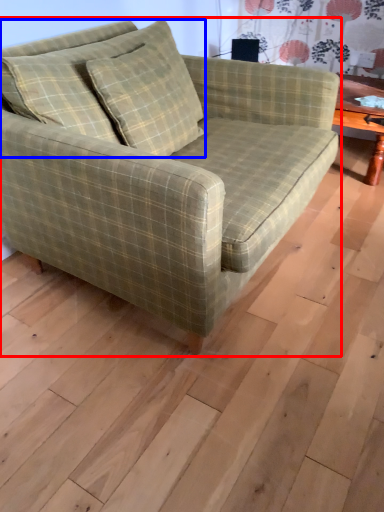
Question: Among these objects, which one is farthest to the camera, studio couch (highlighted by a red box) or pillow (highlighted by a blue box)?

Choices:
 (A) studio couch
 (B) pillow

Answer: (B)